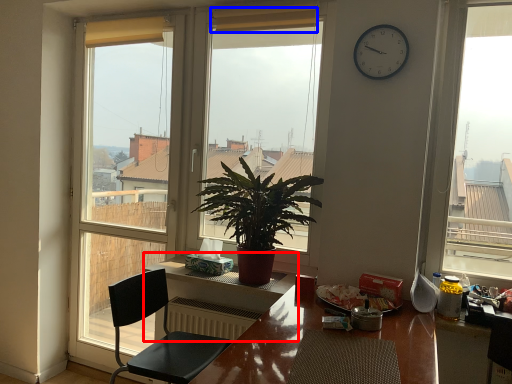
Question: Which object appears closest to the camera in this image, table (highlighted by a red box) or curtain (highlighted by a blue box)?

Choices:
 (A) table
 (B) curtain

Answer: (A)